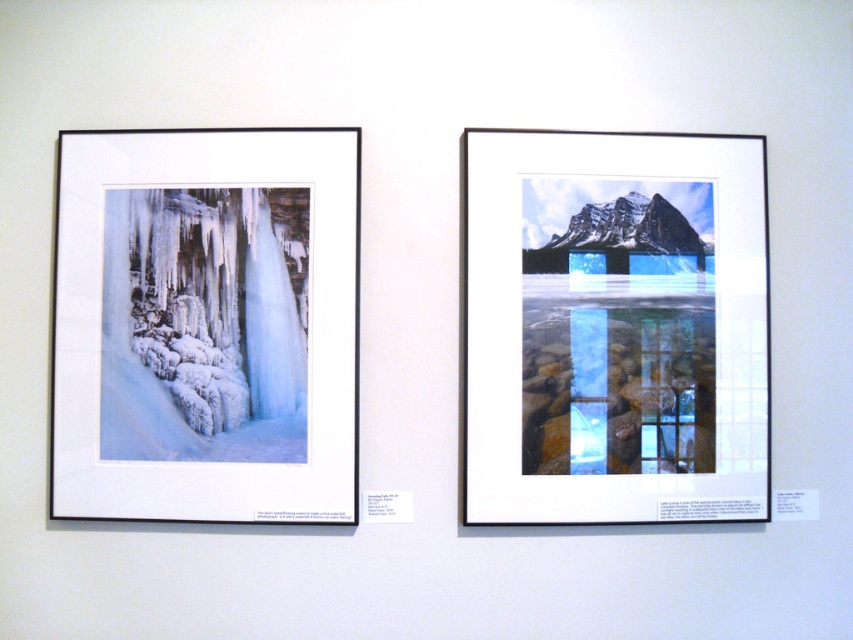
Question: Among these objects, which one is nearest to the camera?

Choices:
 (A) white matte paper at upper right
 (B) white matte paper at left

Answer: (B)

Question: Can you confirm if white matte paper at upper right is positioned above white matte paper at left?

Choices:
 (A) yes
 (B) no

Answer: (A)

Question: Which point is farther to the camera?

Choices:
 (A) (341, 209)
 (B) (546, 492)

Answer: (A)

Question: Does white matte paper at upper right have a lesser width compared to white matte paper at left?

Choices:
 (A) yes
 (B) no

Answer: (B)

Question: Is the position of white matte paper at upper right more distant than that of white matte paper at left?

Choices:
 (A) no
 (B) yes

Answer: (B)